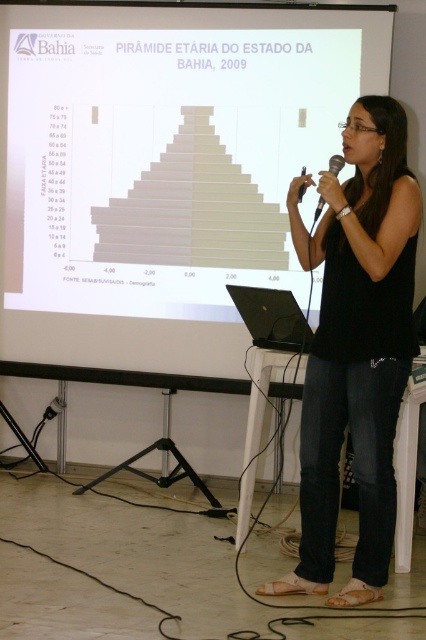
Measure the distance between white paper at upper center and camera.

white paper at upper center is 13.10 feet from camera.

From the picture: Does white paper at upper center appear on the right side of black plastic microphone at center?

No, white paper at upper center is not to the right of black plastic microphone at center.

Who is more distant from viewer, (77, 106) or (316, 212)?

Positioned behind is point (77, 106).

This screenshot has height=640, width=426. I want to click on white paper at upper center, so click(170, 150).

Does point (368, 54) lie in front of point (351, 186)?

No, (368, 54) is behind (351, 186).

Which of these two, white paper at upper center or black cotton shirt at center, stands taller?

black cotton shirt at center is taller.

Locate an element on the screen. Image resolution: width=426 pixels, height=640 pixels. white paper at upper center is located at coordinates [170, 150].

This screenshot has width=426, height=640. In order to click on white paper at upper center in this screenshot , I will do `click(170, 150)`.

Is point (360, 392) more distant than point (313, 225)?

No, it is not.

Which is in front, point (388, 163) or point (340, 164)?

Point (388, 163) is more forward.

Find the location of a particular element. The width and height of the screenshot is (426, 640). black cotton shirt at center is located at coordinates (356, 348).